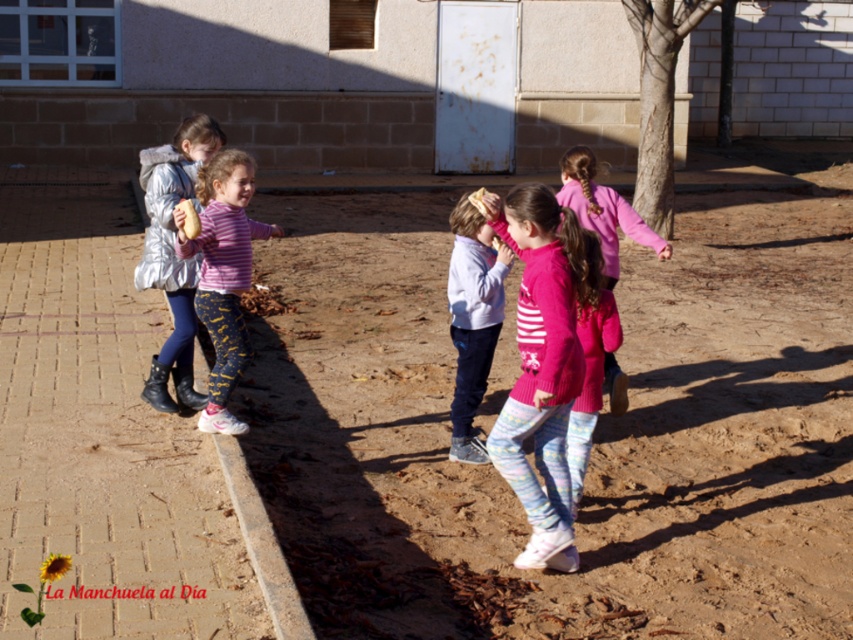
Is point (540, 557) less distant than point (241, 284)?

That is True.

Is knitted pink sweater at center further to camera compared to striped cotton shirt at center?

That is False.

Does point (561, 440) come in front of point (242, 289)?

Yes, point (561, 440) is in front of point (242, 289).

The image size is (853, 640). Find the location of `knitted pink sweater at center`. knitted pink sweater at center is located at coordinates (541, 364).

In the scene shown: Is brown sandy ground at center closer to camera compared to pink fleece jacket at center?

Yes.

From the picture: Is the position of brown sandy ground at center more distant than that of pink fleece jacket at center?

No, brown sandy ground at center is in front of pink fleece jacket at center.

Does point (804, 570) come in front of point (614, 372)?

Yes, it is in front of point (614, 372).

You are a GUI agent. You are given a task and a screenshot of the screen. Output one action in this format:
    pyautogui.click(x=<x>, y=<y>)
    Task: Click on the brown sandy ground at center
    
    Given the screenshot: What is the action you would take?
    pyautogui.click(x=593, y=435)

Is silver metallic jacket at left behind light blue fleece jacket at center?

Yes.

Between point (196, 122) and point (460, 253), which one is positioned behind?

The point (196, 122) is behind.

Find the location of a particular element. The image size is (853, 640). silver metallic jacket at left is located at coordinates (173, 253).